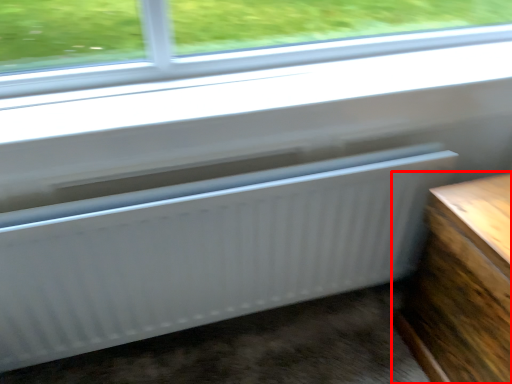
Question: From the image's perspective, what is the correct spatial positioning of furniture (annotated by the red box) in reference to radiator?

Choices:
 (A) below
 (B) above

Answer: (A)